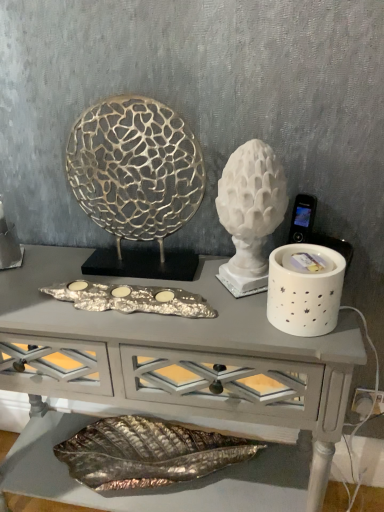
Find the location of `free space between silver metallic tray at center and white ceramic candle holder at right`. free space between silver metallic tray at center and white ceramic candle holder at right is located at coordinates (216, 314).